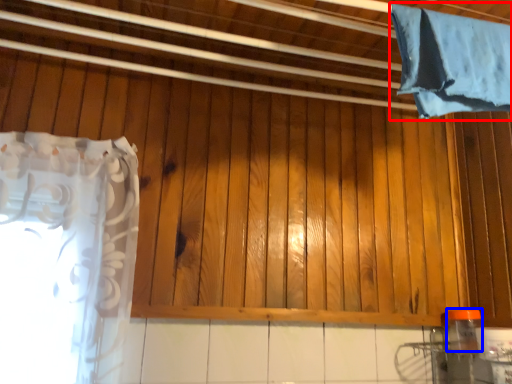
Question: Among these objects, which one is farthest to the camera, curtain (highlighted by a red box) or bottle (highlighted by a blue box)?

Choices:
 (A) curtain
 (B) bottle

Answer: (B)